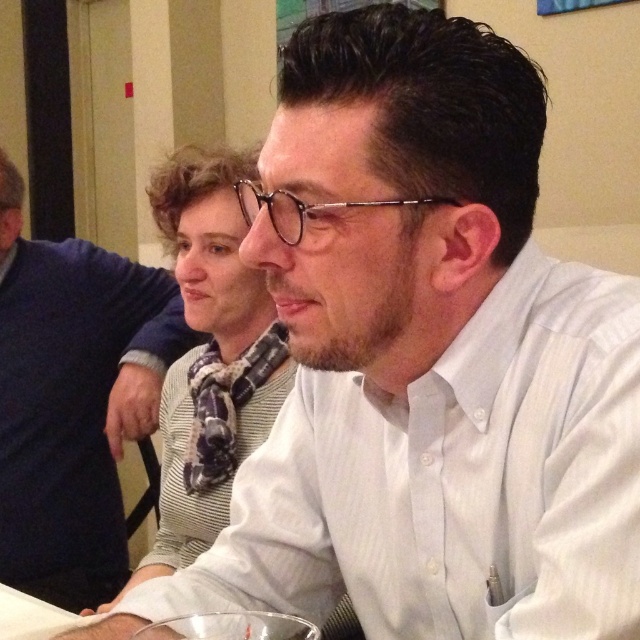
You are standing in the room where the gathering is taking place. You notice two points marked in the image. The first point is at coordinate (x=6, y=330) and the second is at (x=225, y=620). Which point is closer to you?

Point (x=6, y=330) is closer to you because it is further to the viewer than point (x=225, y=620).

You are a photographer standing in front of the scene. You want to take a close up shot of the white shirt at upper center. What is the minimum distance you need to move forward to get the shirt into focus?

The white shirt at upper center is 1.44 meters away from the camera. To take a close up shot, you need to move forward until the distance between you and the shirt is within the camera focus range. However, the exact distance required depends on the camera settings and lens used, so it is best to adjust the focus manually or use a macro lens for close up shots.